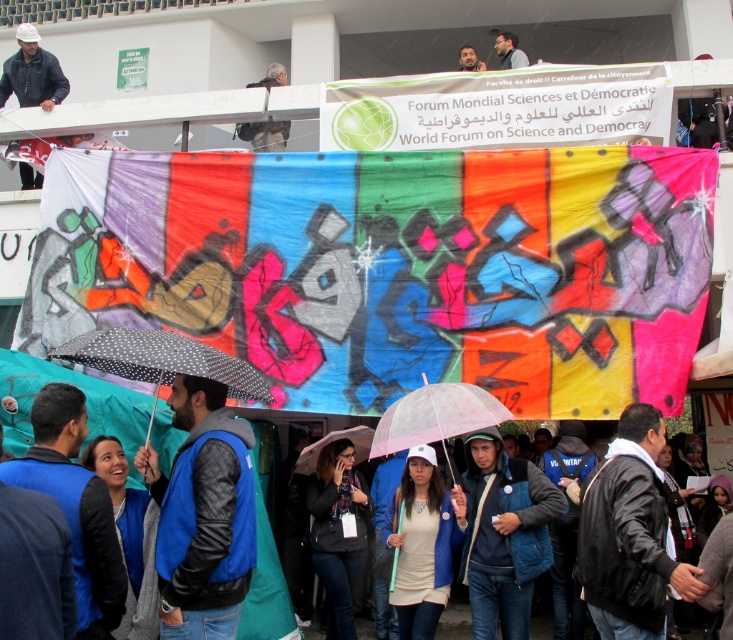
Between black leather jacket at lower right and blue denim jacket at center, which one is positioned higher?

Positioned higher is black leather jacket at lower right.

Is black leather jacket at lower right to the right of blue denim jacket at center from the viewer's perspective?

Yes, black leather jacket at lower right is to the right of blue denim jacket at center.

What do you see at coordinates (629, 534) in the screenshot?
I see `black leather jacket at lower right` at bounding box center [629, 534].

At what (x,y) coordinates should I click in order to perform the action: click on black leather jacket at lower right. Please return your answer as a coordinate pair (x, y). Looking at the image, I should click on (629, 534).

Which is below, white matte baseball cap at center or matte black camera at upper center?

white matte baseball cap at center is lower down.

Between white matte baseball cap at center and matte black camera at upper center, which one has less height?

Standing shorter between the two is white matte baseball cap at center.

Which is in front, point (427, 512) or point (268, 129)?

Point (427, 512)

The image size is (733, 640). Identify the location of white matte baseball cap at center. (421, 541).

Does blue fabric at lower left have a greater height compared to pink matte umbrella at center?

No, blue fabric at lower left is not taller than pink matte umbrella at center.

Who is lower down, blue fabric at lower left or pink matte umbrella at center?

blue fabric at lower left is lower down.

This screenshot has width=733, height=640. Identify the location of blue fabric at lower left. (75, 506).

This screenshot has height=640, width=733. I want to click on blue fabric at lower left, so click(x=75, y=506).